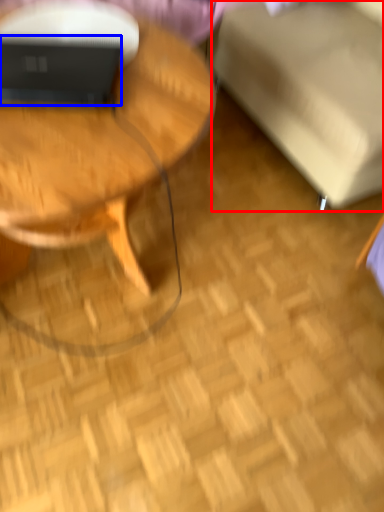
Question: Which point is further to the camera, swivel chair (highlighted by a red box) or laptop (highlighted by a blue box)?

Choices:
 (A) swivel chair
 (B) laptop

Answer: (B)